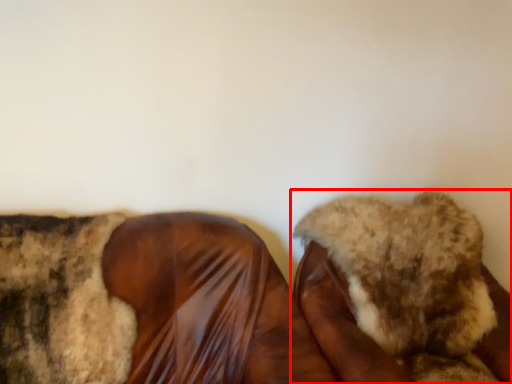
Question: From the image's perspective, what is the correct spatial relationship of footwear (annotated by the red box) in relation to footwear?

Choices:
 (A) below
 (B) above

Answer: (B)